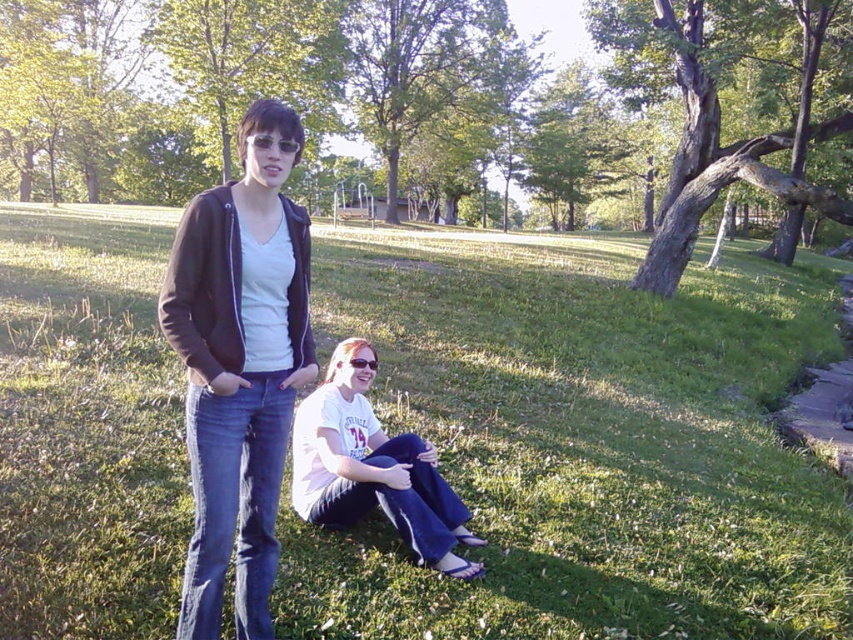
How distant is matte black jacket at center from white cotton shirt at lower center?

They are 30.47 inches apart.

Is point (227, 556) farther from camera compared to point (366, 417)?

No, (227, 556) is closer to viewer.

Does point (265, 520) come closer to viewer compared to point (383, 445)?

Yes.

Find the location of a particular element. This screenshot has height=640, width=853. matte black jacket at center is located at coordinates (239, 365).

Measure the distance between green grass at center and matte black jacket at center.

The distance of green grass at center from matte black jacket at center is 5.66 meters.

Where is `green grass at center`? green grass at center is located at coordinates (582, 444).

I want to click on green grass at center, so pyautogui.click(x=582, y=444).

Between green grass at center and white cotton shirt at lower center, which one has less height?

Standing shorter between the two is white cotton shirt at lower center.

Can you confirm if green grass at center is bigger than white cotton shirt at lower center?

Yes.

This screenshot has width=853, height=640. I want to click on green grass at center, so click(582, 444).